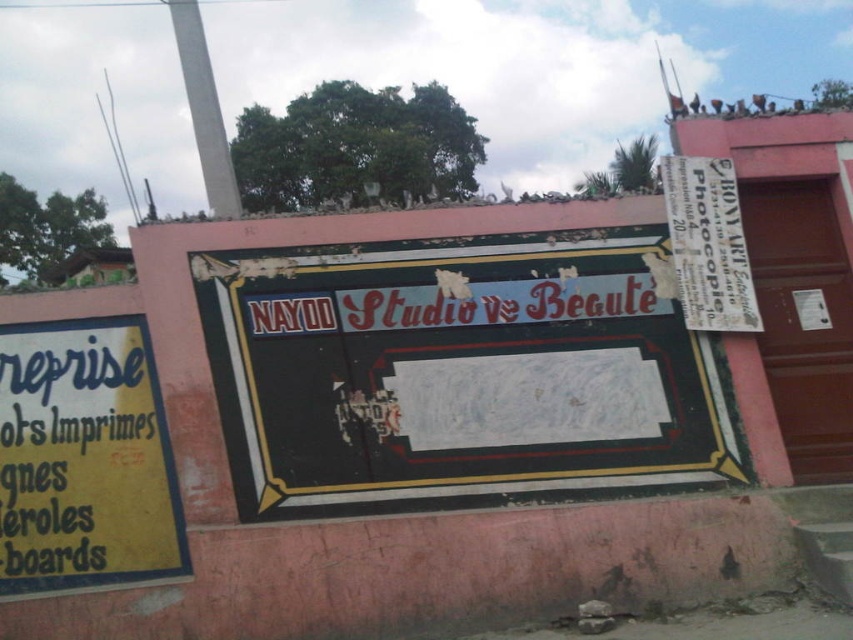
Question: Which of the following is the farthest from the observer?

Choices:
 (A) (285, 289)
 (B) (734, 211)
 (C) (170, 554)

Answer: (B)

Question: Can you confirm if rusty metal signboard at center is positioned above white paper at upper right?

Choices:
 (A) yes
 (B) no

Answer: (B)

Question: Does rusty metal signboard at center appear on the right side of yellow paper at left?

Choices:
 (A) no
 (B) yes

Answer: (B)

Question: Which point is farther to the camera?

Choices:
 (A) (699, 317)
 (B) (115, 352)
 (C) (643, 269)

Answer: (C)

Question: Which point appears farthest from the camera in this image?

Choices:
 (A) (740, 289)
 (B) (19, 468)

Answer: (A)

Question: Does yellow paper at left come behind white paper at upper right?

Choices:
 (A) no
 (B) yes

Answer: (A)